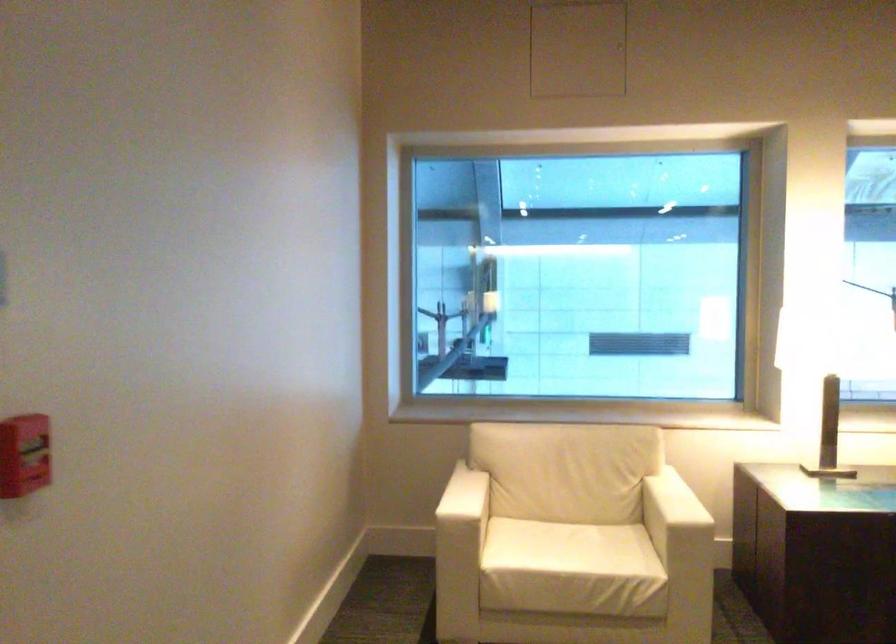
Where is `chair sitting surface`? The image size is (896, 644). chair sitting surface is located at coordinates (566, 547).